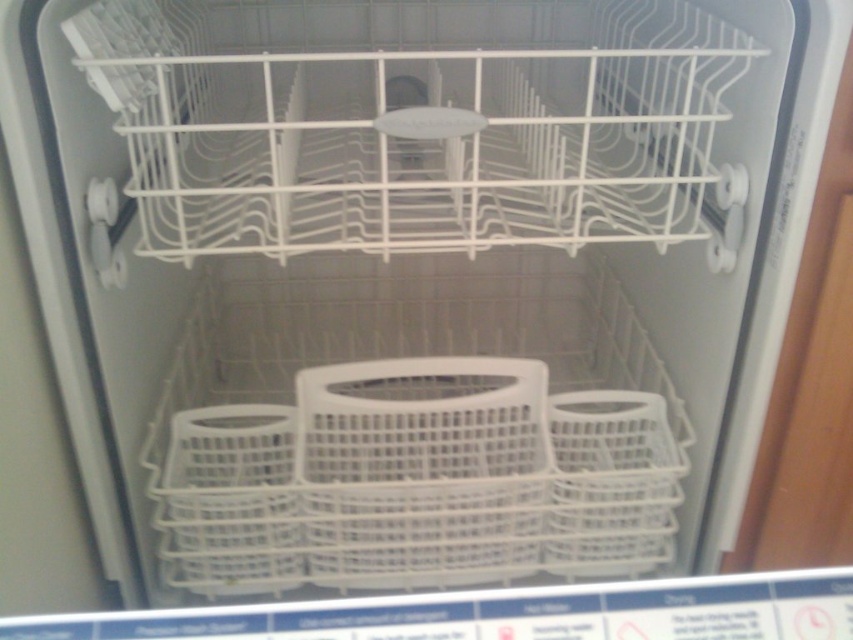
Question: Is white plastic basket at center to the left of white plastic basket at lower left from the viewer's perspective?

Choices:
 (A) no
 (B) yes

Answer: (A)

Question: Is white plastic basket at center further to camera compared to white plastic basket at lower left?

Choices:
 (A) no
 (B) yes

Answer: (B)

Question: Which point is farther to the camera?

Choices:
 (A) white plastic basket at lower left
 (B) white plastic basket at center

Answer: (B)

Question: Does white plastic basket at center appear on the right side of white plastic basket at lower left?

Choices:
 (A) yes
 (B) no

Answer: (A)